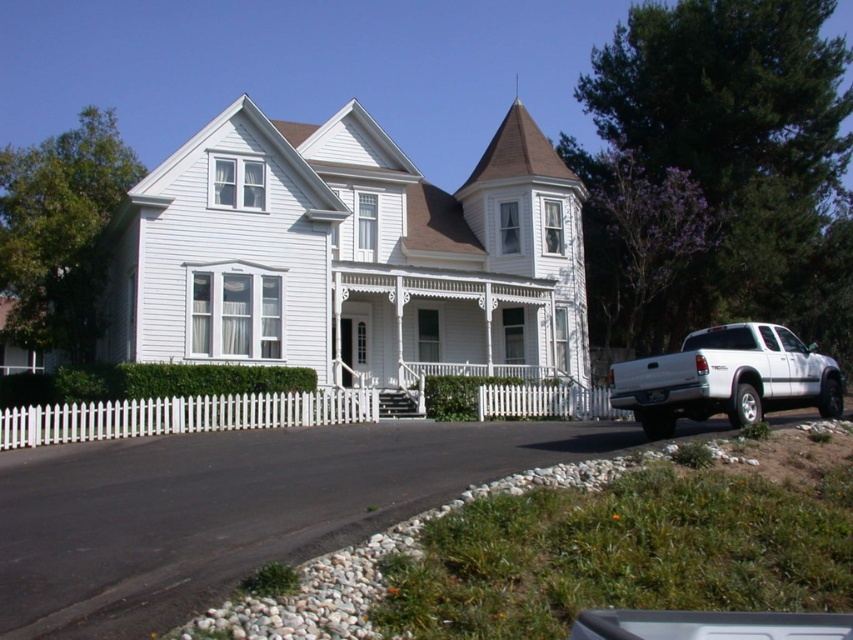
In the scene shown: You are standing at the front gate of the house and want to park your white matte truck at lower right near the garage. Which side of the white picket fence at center should you approach to reach the truck?

The white matte truck at lower right is to the right of the white picket fence at center, so you should approach the right side of the white picket fence at center to reach the truck.

You are standing at the front gate of the property and want to park your white matte truck at lower right in a spot that is not blocked by the white picket fence at center. Based on the scene description, can you park the truck in a position where it is visible from the front gate without obstruction?

The white matte truck at lower right is above the white picket fence at center, so it can be parked in a position where it is visible from the front gate without obstruction.